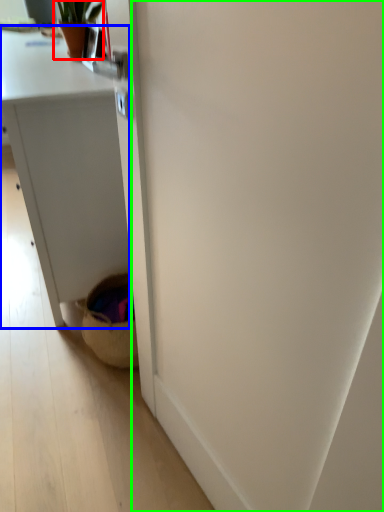
Question: Which object is positioned closest to houseplant (highlighted by a red box)? Select from desk (highlighted by a blue box) and screen door (highlighted by a green box).

Choices:
 (A) desk
 (B) screen door

Answer: (A)